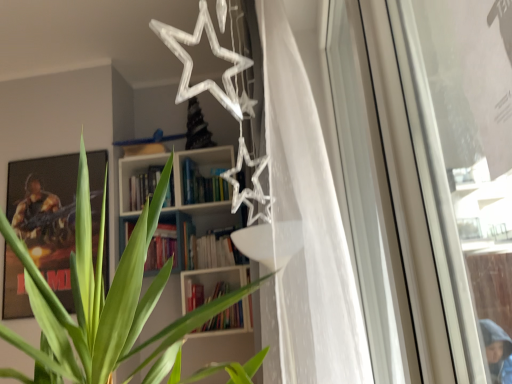
Where is `transparent glass window at upper right`? The width and height of the screenshot is (512, 384). transparent glass window at upper right is located at coordinates (425, 161).

The height and width of the screenshot is (384, 512). Describe the element at coordinates (425, 161) in the screenshot. I see `transparent glass window at upper right` at that location.

Find the location of `transparent glass window at upper right`. transparent glass window at upper right is located at coordinates (425, 161).